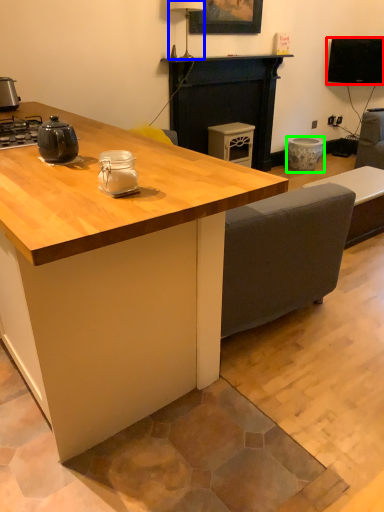
Question: Based on their relative distances, which object is nearer to television (highlighted by a red box)? Choose from lamp (highlighted by a blue box) and appliance (highlighted by a green box).

Choices:
 (A) lamp
 (B) appliance

Answer: (B)